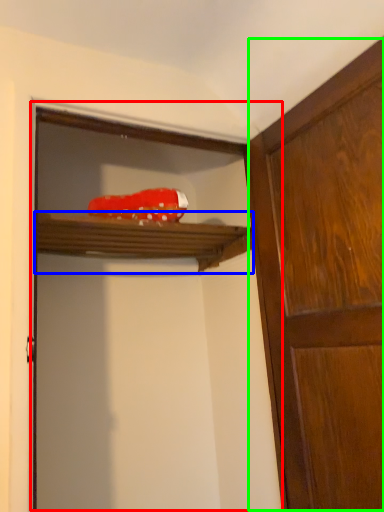
Question: Estimate the real-world distances between objects in this image. Which object is closer to screen door (highlighted by a red box), shelf (highlighted by a blue box) or cabinetry (highlighted by a green box)?

Choices:
 (A) shelf
 (B) cabinetry

Answer: (A)